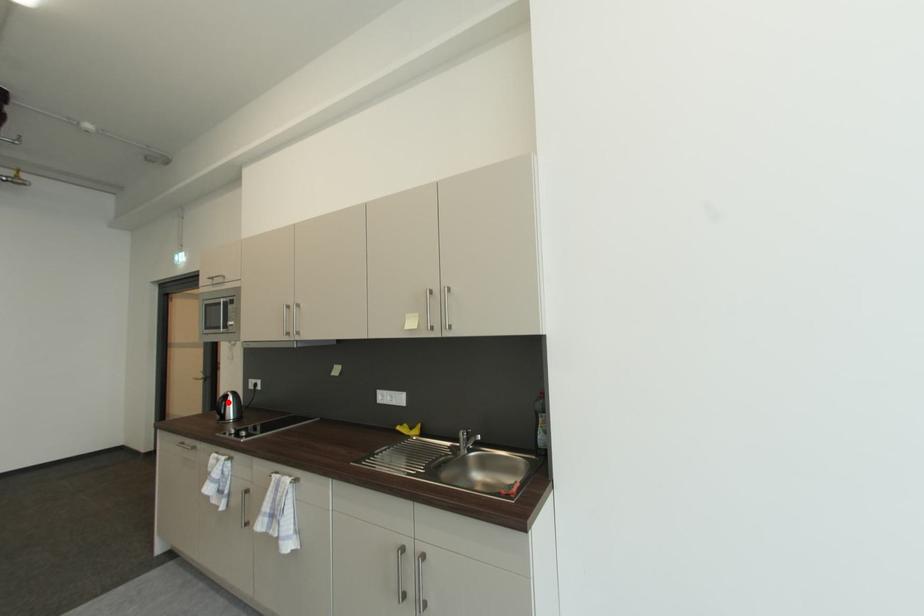
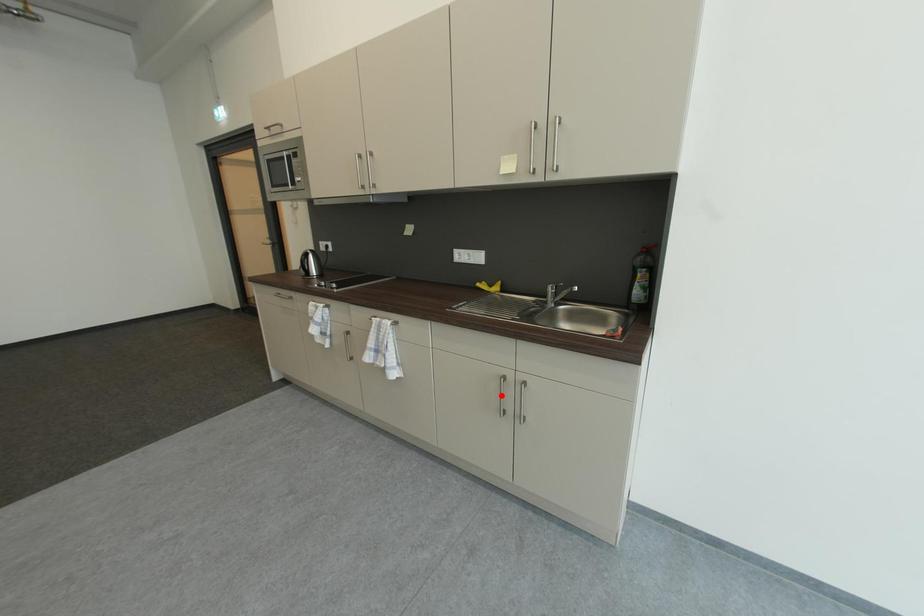
Consider the image. I am providing you with two images of the same scene from different viewpoints. A red point is marked on the first image and another point is marked on the second image. Is the marked point in image1 the same physical position as the marked point in image2?

No